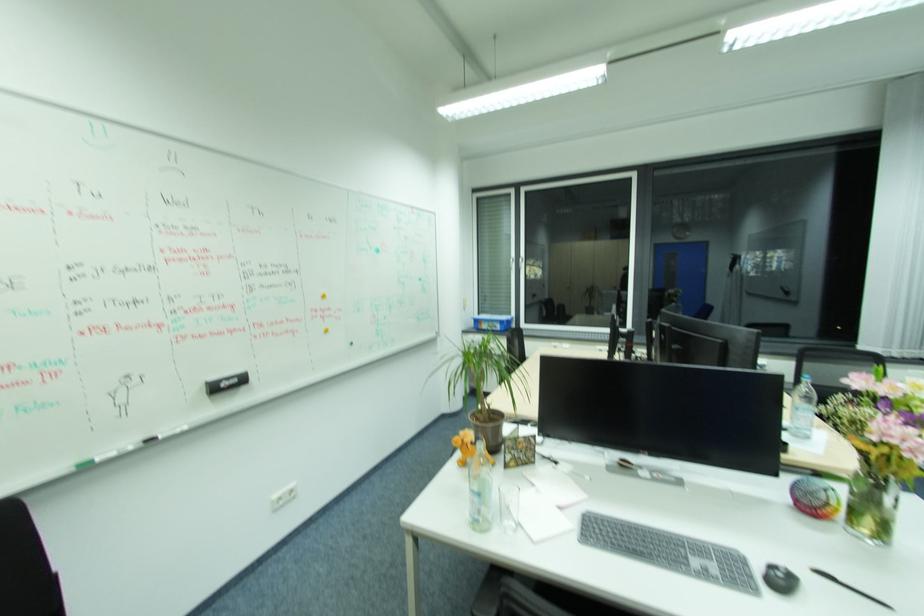
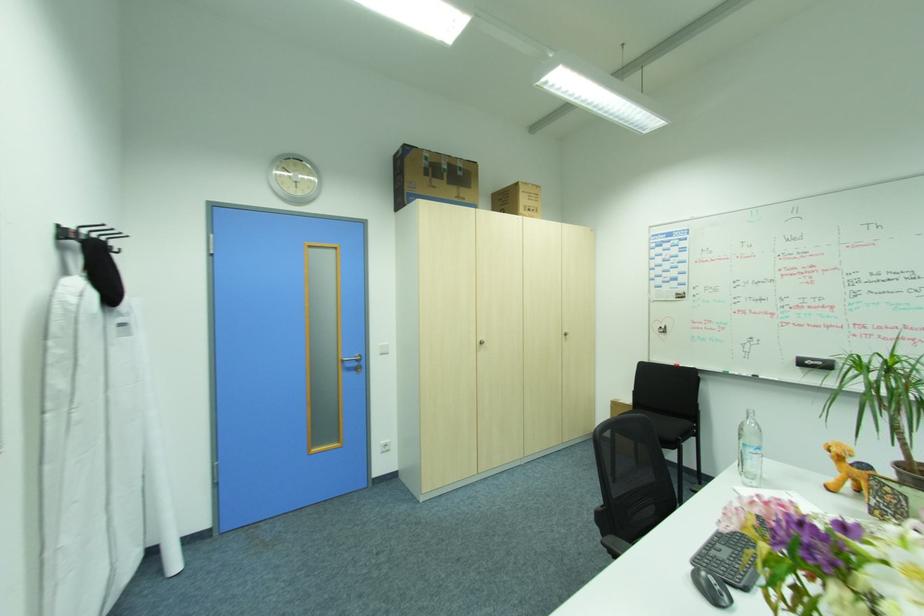
Where in the second image is the point corresponding to [240,381] from the first image?

(824, 363)